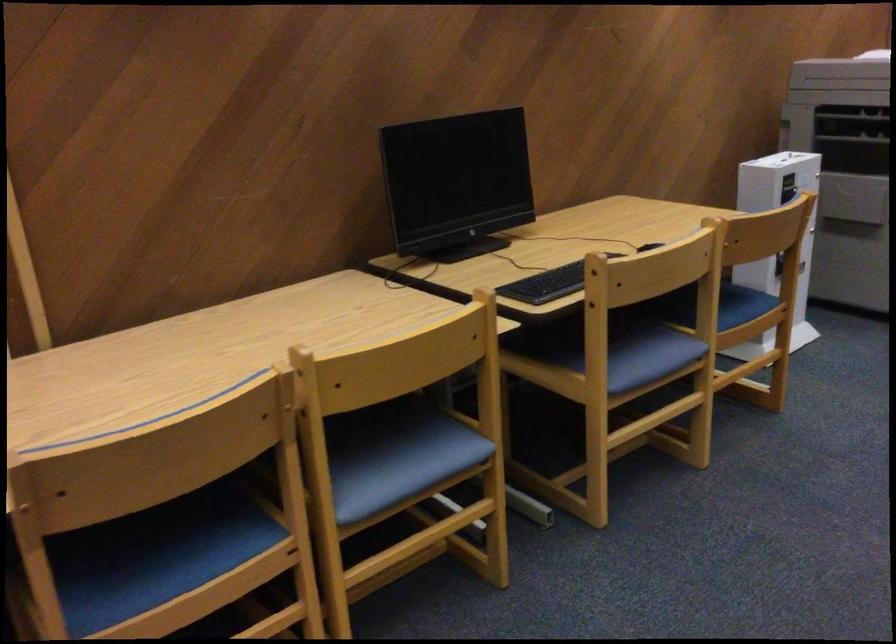
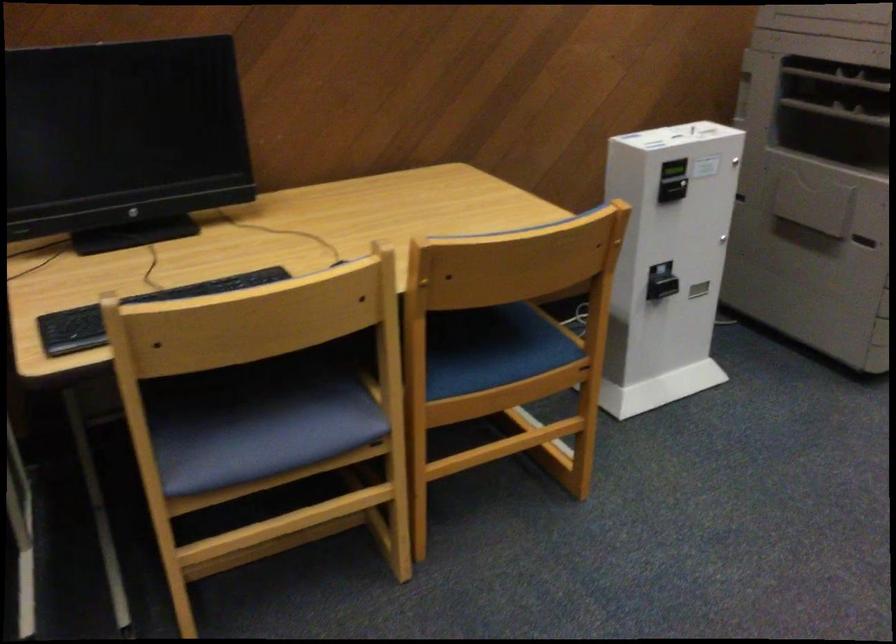
In the second image, find the point that corresponds to point (789, 174) in the first image.

(673, 169)